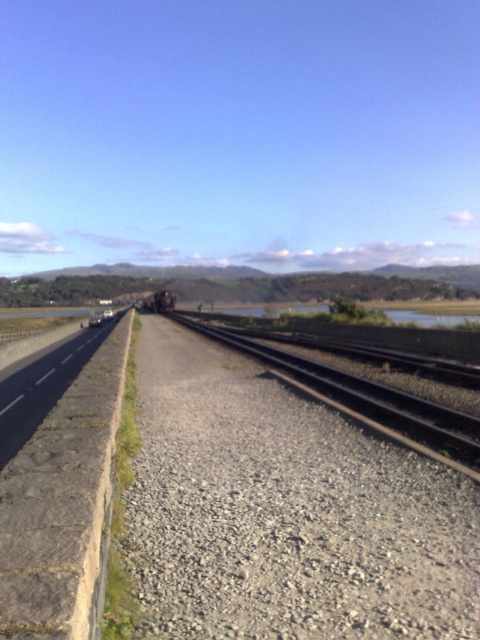
Question: Which object appears closest to the camera in this image?

Choices:
 (A) gray concrete highway at left
 (B) metallic gray train at center

Answer: (A)

Question: Among these points, which one is nearest to the camera?

Choices:
 (A) (165, 296)
 (B) (95, 580)

Answer: (B)

Question: Is gray concrete highway at left thinner than metallic gray train at center?

Choices:
 (A) yes
 (B) no

Answer: (A)

Question: Does metal train track at center appear on the left side of metallic gray train at center?

Choices:
 (A) yes
 (B) no

Answer: (B)

Question: Does gray concrete highway at left have a larger size compared to metallic gray train at center?

Choices:
 (A) no
 (B) yes

Answer: (A)

Question: Which object is farther from the camera taking this photo?

Choices:
 (A) metal train track at center
 (B) gray concrete highway at left
 (C) metallic gray train at center

Answer: (C)